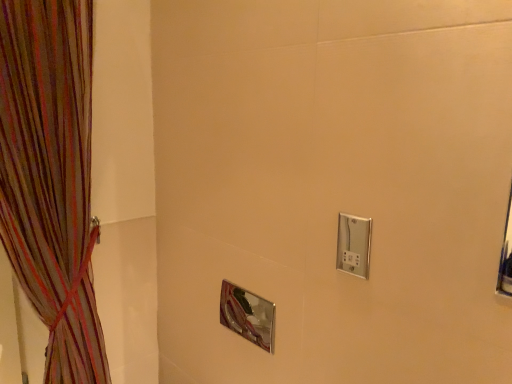
Question: Is satin nickel switch at upper right positioned in front of multicolored sheer curtain at left?

Choices:
 (A) no
 (B) yes

Answer: (A)

Question: From a real-world perspective, is satin nickel switch at upper right over multicolored sheer curtain at left?

Choices:
 (A) no
 (B) yes

Answer: (B)

Question: Does satin nickel switch at upper right appear on the left side of multicolored sheer curtain at left?

Choices:
 (A) no
 (B) yes

Answer: (A)

Question: Could you tell me if satin nickel switch at upper right is facing multicolored sheer curtain at left?

Choices:
 (A) no
 (B) yes

Answer: (A)

Question: Can you confirm if satin nickel switch at upper right is bigger than multicolored sheer curtain at left?

Choices:
 (A) no
 (B) yes

Answer: (A)

Question: Based on their sizes in the image, would you say polished chrome mirror at center is bigger or smaller than multicolored sheer curtain at left?

Choices:
 (A) big
 (B) small

Answer: (B)

Question: Do you think polished chrome mirror at center is within multicolored sheer curtain at left, or outside of it?

Choices:
 (A) outside
 (B) inside

Answer: (A)

Question: In the image, is polished chrome mirror at center positioned in front of or behind multicolored sheer curtain at left?

Choices:
 (A) front
 (B) behind

Answer: (B)

Question: Considering the positions of polished chrome mirror at center and multicolored sheer curtain at left in the image, is polished chrome mirror at center wider or thinner than multicolored sheer curtain at left?

Choices:
 (A) wide
 (B) thin

Answer: (B)

Question: Is point (266, 302) closer or farther from the camera than point (344, 266)?

Choices:
 (A) farther
 (B) closer

Answer: (A)

Question: Based on their sizes in the image, would you say polished chrome mirror at center is bigger or smaller than satin nickel switch at upper right?

Choices:
 (A) big
 (B) small

Answer: (A)

Question: Is polished chrome mirror at center in front of or behind satin nickel switch at upper right in the image?

Choices:
 (A) behind
 (B) front

Answer: (A)

Question: Is polished chrome mirror at center situated inside satin nickel switch at upper right or outside?

Choices:
 (A) inside
 (B) outside

Answer: (B)

Question: From a real-world perspective, is multicolored sheer curtain at left physically located above or below satin nickel switch at upper right?

Choices:
 (A) below
 (B) above

Answer: (A)

Question: Would you say multicolored sheer curtain at left is to the left or to the right of satin nickel switch at upper right in the picture?

Choices:
 (A) right
 (B) left

Answer: (B)